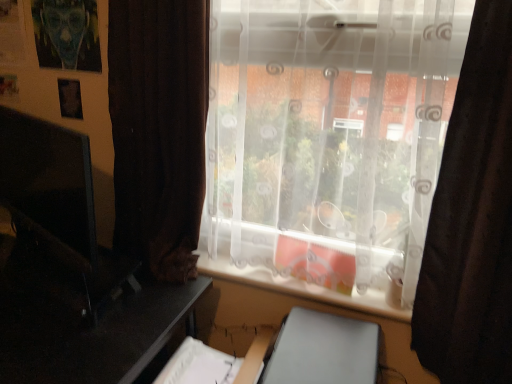
Question: Does matte black monitor at left touch transparent fabric at center?

Choices:
 (A) yes
 (B) no

Answer: (B)

Question: Is transparent fabric at center surrounded by matte black monitor at left?

Choices:
 (A) yes
 (B) no

Answer: (B)

Question: Could you tell me if matte black monitor at left is facing transparent fabric at center?

Choices:
 (A) no
 (B) yes

Answer: (A)

Question: From a real-world perspective, is matte black monitor at left located higher than transparent fabric at center?

Choices:
 (A) yes
 (B) no

Answer: (B)

Question: Does matte black monitor at left have a greater height compared to transparent fabric at center?

Choices:
 (A) yes
 (B) no

Answer: (B)

Question: Based on their sizes in the image, would you say brown fabric curtain at right is bigger or smaller than matte black monitor at left?

Choices:
 (A) small
 (B) big

Answer: (B)

Question: Based on their positions, is brown fabric curtain at right located to the left or right of matte black monitor at left?

Choices:
 (A) left
 (B) right

Answer: (B)

Question: Is brown fabric curtain at right in front of or behind matte black monitor at left in the image?

Choices:
 (A) front
 (B) behind

Answer: (A)

Question: Is brown fabric curtain at right wider or thinner than matte black monitor at left?

Choices:
 (A) wide
 (B) thin

Answer: (A)

Question: Is point (10, 360) closer or farther from the camera than point (22, 170)?

Choices:
 (A) farther
 (B) closer

Answer: (B)

Question: Considering the positions of black glossy table at left and matte black monitor at left in the image, is black glossy table at left bigger or smaller than matte black monitor at left?

Choices:
 (A) small
 (B) big

Answer: (B)

Question: Is black glossy table at left situated inside matte black monitor at left or outside?

Choices:
 (A) inside
 (B) outside

Answer: (B)

Question: From a real-world perspective, is black glossy table at left positioned above or below matte black monitor at left?

Choices:
 (A) below
 (B) above

Answer: (A)

Question: From a real-world perspective, is transparent fabric at center above or below matte black monitor at left?

Choices:
 (A) below
 (B) above

Answer: (B)

Question: In terms of height, does transparent fabric at center look taller or shorter compared to matte black monitor at left?

Choices:
 (A) short
 (B) tall

Answer: (B)